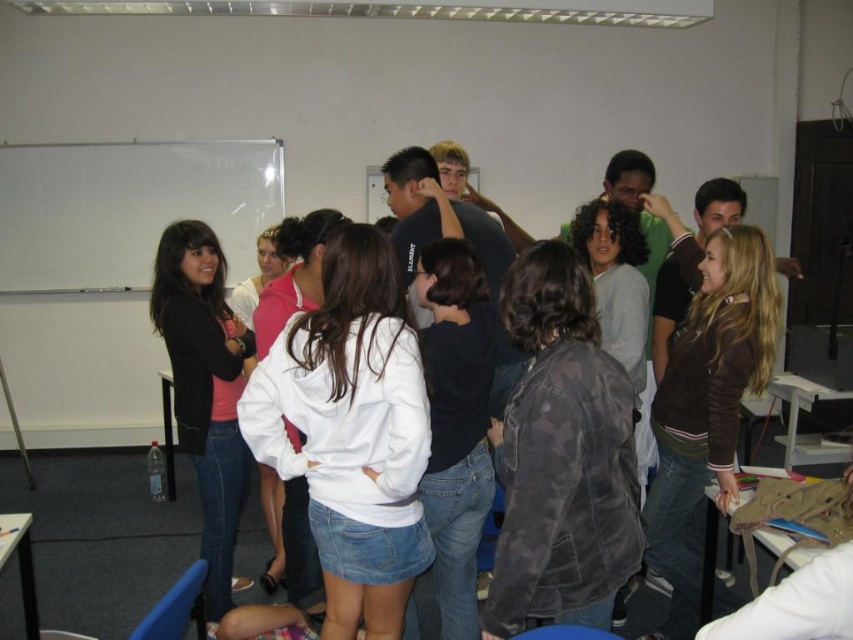
Question: Does white cotton hoodie at center have a smaller size compared to dark gray denim jacket at center?

Choices:
 (A) yes
 (B) no

Answer: (B)

Question: Which point appears farthest from the camera in this image?

Choices:
 (A) (490, 330)
 (B) (511, 396)

Answer: (A)

Question: Can you confirm if camouflage jacket at center is positioned below matte black hoodie at center?

Choices:
 (A) yes
 (B) no

Answer: (B)

Question: Which of the following is the closest to the observer?

Choices:
 (A) brown suede jacket at center
 (B) camouflage jacket at center
 (C) dark gray denim jacket at center
 (D) white cotton hoodie at center

Answer: (B)

Question: Is white cotton hoodie at center thinner than camouflage jacket at center?

Choices:
 (A) no
 (B) yes

Answer: (A)

Question: Which point appears farthest from the camera in this image?

Choices:
 (A) (213, 244)
 (B) (677, 348)
 (C) (321, 312)

Answer: (A)